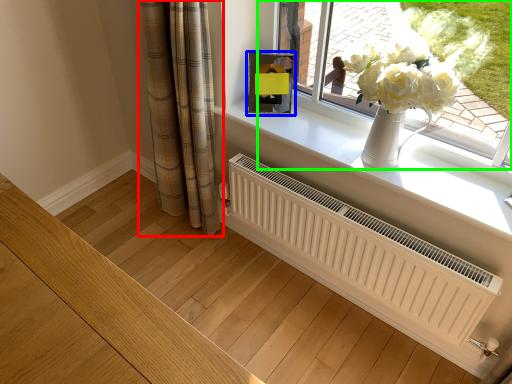
Question: Which object is the farthest from curtain (highlighted by a red box)? Choose among these: picture frame (highlighted by a blue box) or window (highlighted by a green box).

Choices:
 (A) picture frame
 (B) window

Answer: (B)